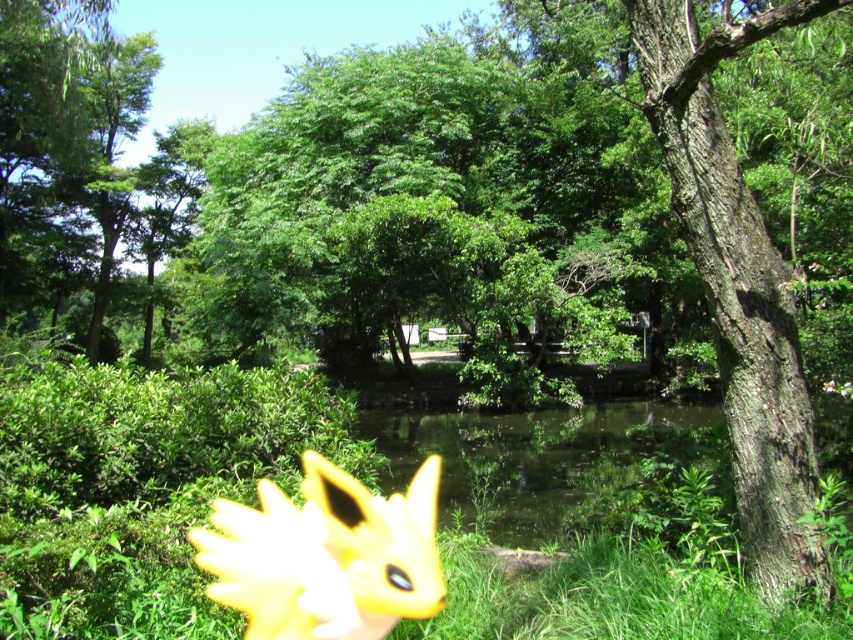
Question: Which of these objects is positioned farthest from the yellow plush toy at lower left?

Choices:
 (A) smooth brown bark at right
 (B) clear water at center

Answer: (B)

Question: Among these points, which one is farthest from the camera?

Choices:
 (A) (305, 486)
 (B) (792, 508)
 (C) (473, 436)

Answer: (C)

Question: Is smooth brown bark at right bigger than yellow plush toy at lower left?

Choices:
 (A) yes
 (B) no

Answer: (A)

Question: Based on their relative distances, which object is nearer to the yellow plush toy at lower left?

Choices:
 (A) smooth brown bark at right
 (B) clear water at center

Answer: (A)

Question: Can you confirm if smooth brown bark at right is positioned below clear water at center?

Choices:
 (A) yes
 (B) no

Answer: (B)

Question: Is yellow plush toy at lower left in front of clear water at center?

Choices:
 (A) yes
 (B) no

Answer: (A)